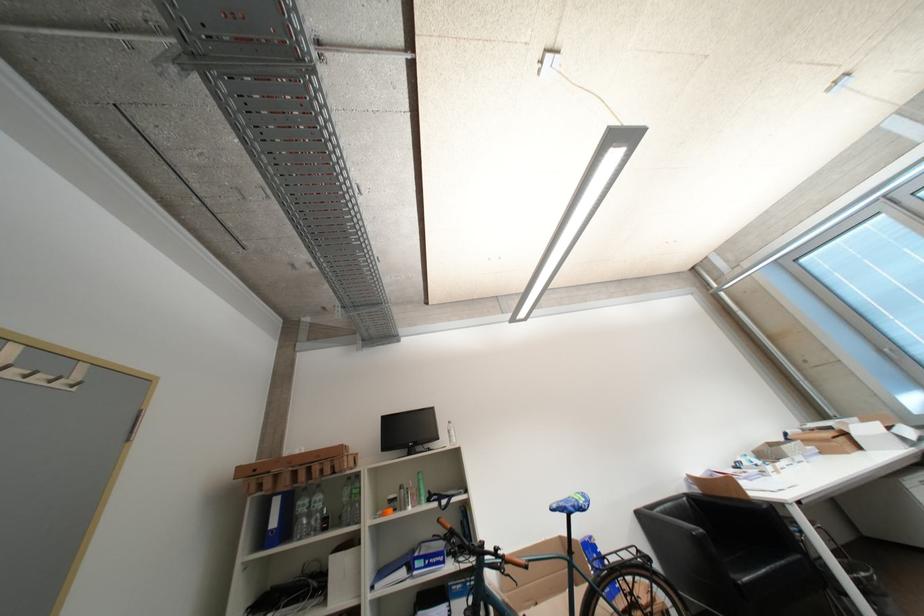
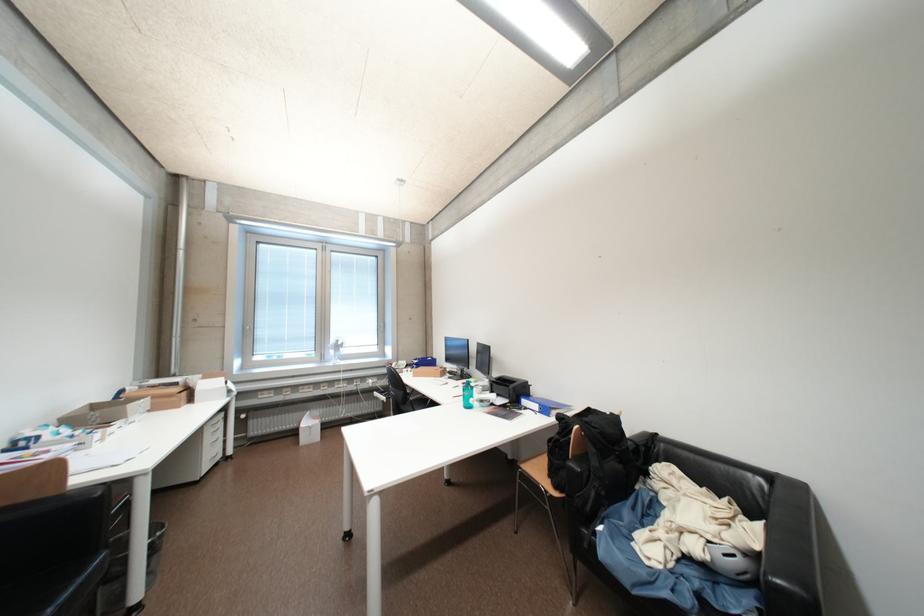
Locate, in the second image, the point that corresponds to point (852, 440) in the first image.

(192, 395)